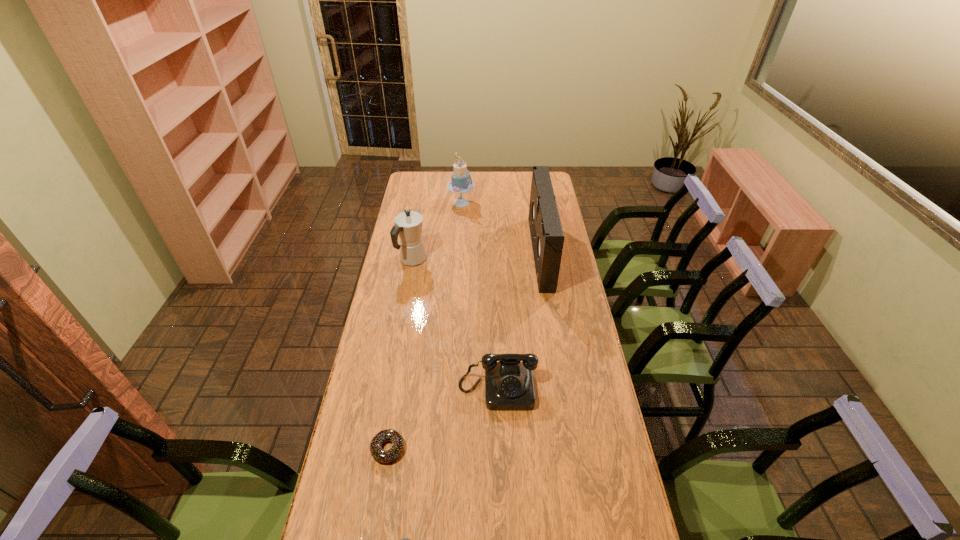
I want to click on free space at the far left corner of the desktop, so click(420, 187).

Find the location of a particular element. Image resolution: width=960 pixels, height=540 pixels. vacant area that lies between the coffeepot and the videotape is located at coordinates (476, 256).

Locate an element on the screen. vacant space in between the doughnut and the coffeepot is located at coordinates (400, 354).

At what (x,y) coordinates should I click in order to perform the action: click on free space between the coffeepot and the telephone. Please return your answer as a coordinate pair (x, y). This screenshot has height=540, width=960. Looking at the image, I should click on (455, 324).

This screenshot has height=540, width=960. In order to click on free space between the third nearest object and the rightmost object in this screenshot , I will do `click(519, 321)`.

The width and height of the screenshot is (960, 540). What are the coordinates of `unoccupied position between the coffeepot and the fifth farthest object` in the screenshot? It's located at (400, 354).

Identify the location of empty space that is in between the videotape and the coffeepot. This screenshot has height=540, width=960. (476, 256).

The height and width of the screenshot is (540, 960). What are the coordinates of `empty space that is in between the videotape and the cake` in the screenshot? It's located at (501, 228).

You are a GUI agent. You are given a task and a screenshot of the screen. Output one action in this format:
    pyautogui.click(x=<x>, y=<y>)
    Task: Click on the unoccupied area between the farthest object and the videotape
    This screenshot has width=960, height=540.
    Given the screenshot: What is the action you would take?
    pyautogui.click(x=501, y=228)

This screenshot has height=540, width=960. Identify the location of the fifth closest object to the cake. (403, 539).